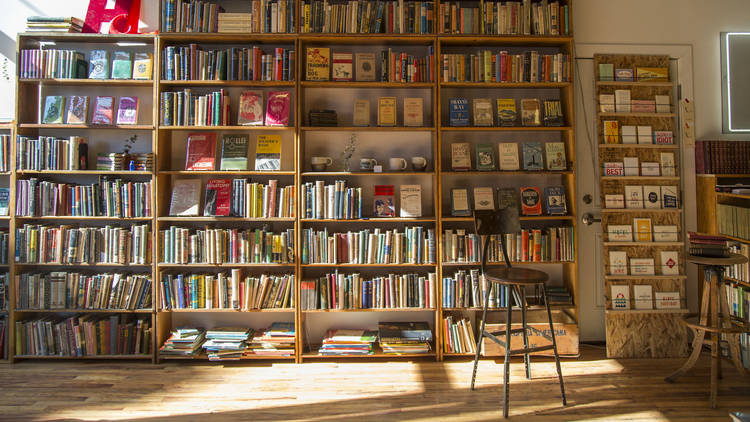
I want to click on thinner books, so click(x=225, y=342), click(x=350, y=341).